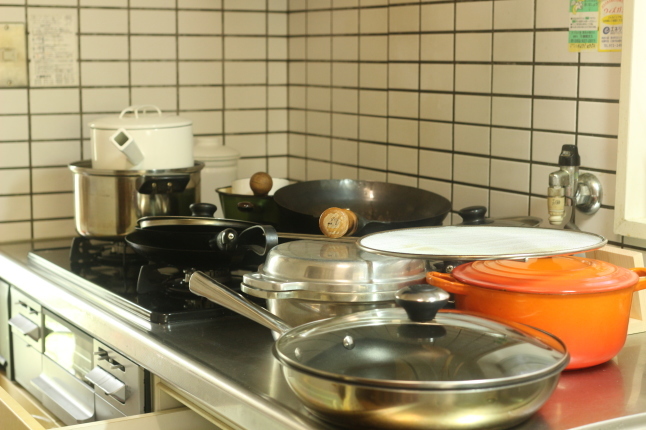
I want to click on orange dish, so click(x=566, y=310).